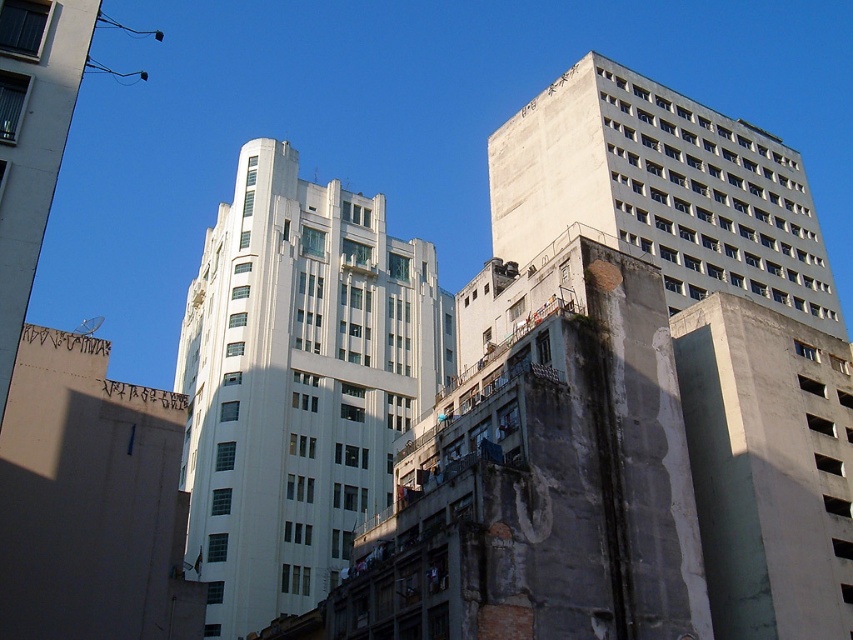
You are standing in the middle of the urban area and want to take a photo of both the white smooth building at center and the concrete building at upper right. Which building should you focus on first to ensure both are in the frame?

You should focus on the white smooth building at center first because it is closer to you than the concrete building at upper right, so adjusting the camera to include both would require framing starting from the closer one.

You are a drone operator planning to fly a drone between the white smooth building at center and the concrete building at upper right. The drone has a maximum flight distance of 25 meters. Can the drone safely travel between these two buildings without exceeding its range?

The distance between the white smooth building at center and the concrete building at upper right is 25.99 meters, which exceeds the drone operator maximum flight distance of 25 meters. Therefore, the drone cannot safely travel between these two buildings without exceeding its range.

You are standing at the point marked at coordinates point (256, 172). You want to walk to the nearest building. Which building should you head towards?

The point marked at coordinates point (256, 172) is 91.03 meters away from the nearest building. Therefore, you should head towards the nearest building which is the one with the Art Deco style, as it is closer than the modern building to the point.